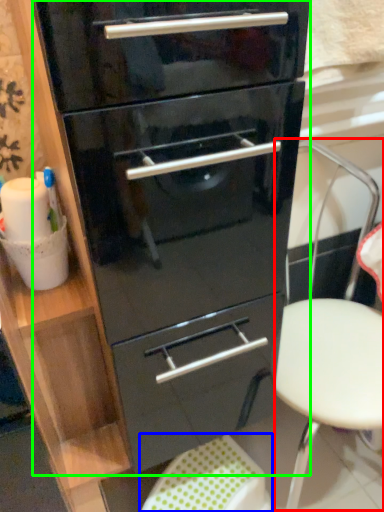
Question: Which object is the closest to the folding chair (highlighted by a red box)? Choose among these: step stool (highlighted by a blue box) or chest of drawers (highlighted by a green box).

Choices:
 (A) step stool
 (B) chest of drawers

Answer: (B)